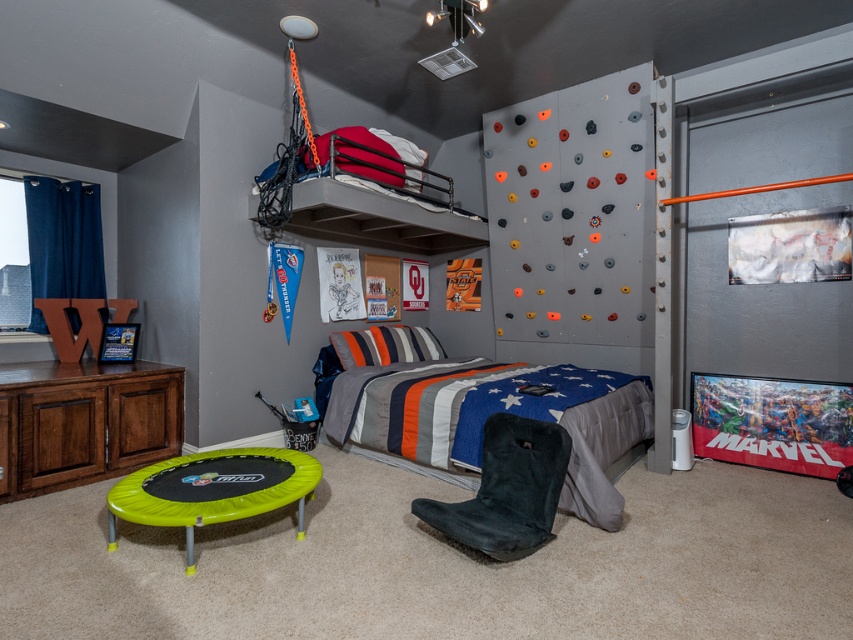
Question: Observing the image, what is the correct spatial positioning of striped fabric bed at center in reference to matte black bunk bed at upper center?

Choices:
 (A) below
 (B) above

Answer: (A)

Question: Can you confirm if striped fabric bed at center is bigger than brown wood dresser at lower left?

Choices:
 (A) yes
 (B) no

Answer: (A)

Question: Observing the image, what is the correct spatial positioning of brown wood dresser at lower left in reference to matte black bunk bed at upper center?

Choices:
 (A) above
 (B) below

Answer: (B)

Question: Which object appears closest to the camera in this image?

Choices:
 (A) brown wood dresser at lower left
 (B) matte black bunk bed at upper center

Answer: (A)

Question: Which object is the closest to the striped fabric bed at center?

Choices:
 (A) matte black bunk bed at upper center
 (B) brown wood dresser at lower left

Answer: (A)

Question: Which of these objects is positioned closest to the brown wood dresser at lower left?

Choices:
 (A) matte black bunk bed at upper center
 (B) striped fabric bed at center

Answer: (B)